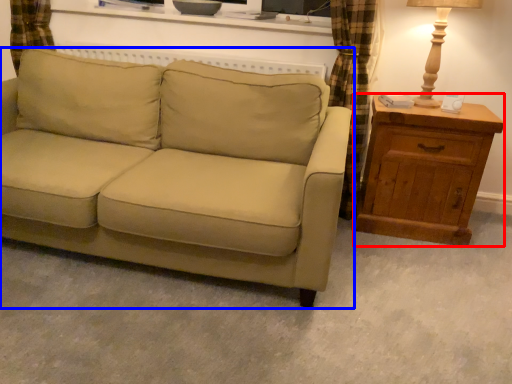
Question: Which object appears closest to the camera in this image, chest of drawers (highlighted by a red box) or studio couch (highlighted by a blue box)?

Choices:
 (A) chest of drawers
 (B) studio couch

Answer: (B)